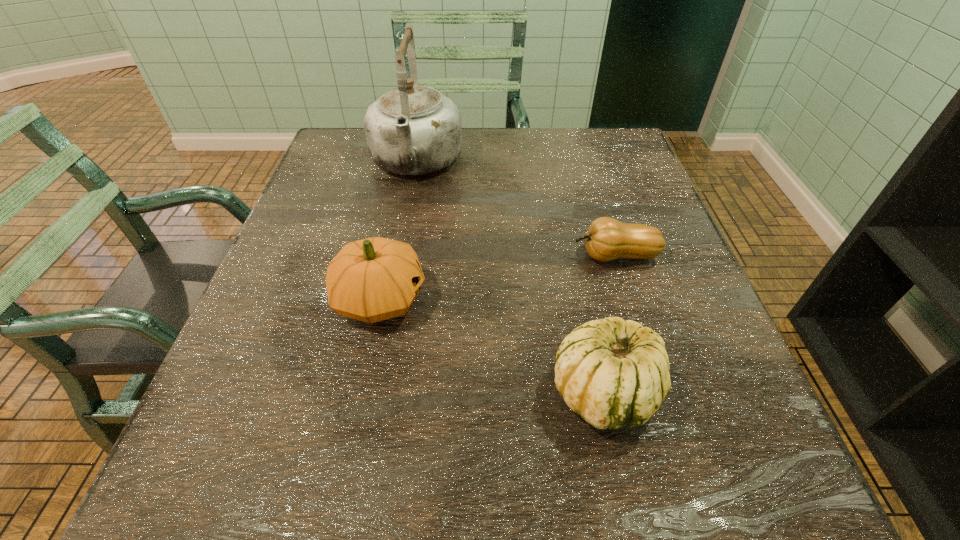
The image size is (960, 540). I want to click on the tallest object, so click(411, 130).

At what (x,y) coordinates should I click in order to perform the action: click on kettle. Please return your answer as a coordinate pair (x, y). The image size is (960, 540). Looking at the image, I should click on (411, 130).

Image resolution: width=960 pixels, height=540 pixels. Find the location of `the leftmost gourd`. the leftmost gourd is located at coordinates pyautogui.click(x=374, y=279).

This screenshot has height=540, width=960. Find the location of `the nearest gourd`. the nearest gourd is located at coordinates 614,373.

The height and width of the screenshot is (540, 960). I want to click on the shortest object, so click(x=607, y=239).

Find the location of a particular element. This screenshot has width=960, height=540. vacant space located at the spout of the tallest object is located at coordinates (401, 243).

Find the location of a particular element. free region located 0.350m on the side of the leftmost gourd with the carved face is located at coordinates (621, 299).

This screenshot has width=960, height=540. I want to click on free space located on the left of the nearest gourd, so click(419, 390).

Where is `free space located 0.160m on the stem side of the shortest gourd`? This screenshot has height=540, width=960. free space located 0.160m on the stem side of the shortest gourd is located at coordinates (492, 255).

Locate an element on the screen. This screenshot has height=540, width=960. blank space located 0.380m on the stem side of the shortest gourd is located at coordinates (382, 255).